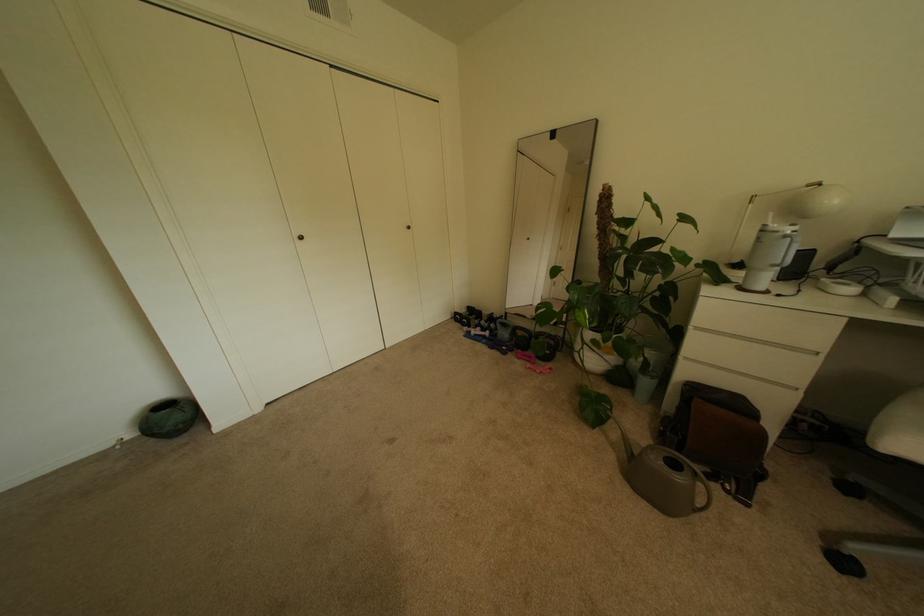
Describe the element at coordinates (681, 500) in the screenshot. I see `the watering can handle` at that location.